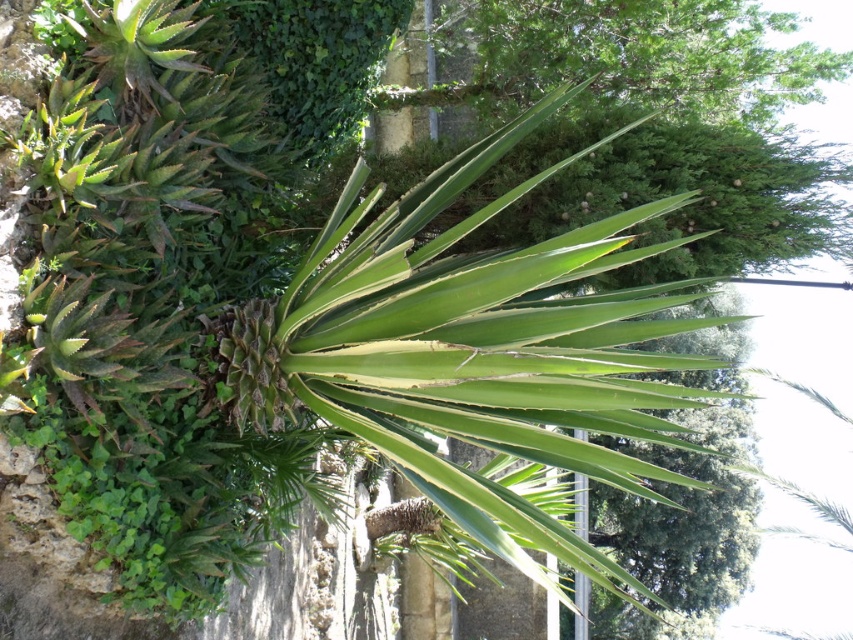
What are the coordinates of the green leafy palm tree at center?

The green leafy palm tree at center is located at coordinates point (474, 352).

You are a gardener who needs to water both the green leafy palm tree at center and the green leafy plant at center. Your watering can has a range of 3 meters. Can you water both plants without moving the watering can?

The distance between the green leafy palm tree at center and the green leafy plant at center is 3.38 meters, which exceeds the watering can range of 3 meters. Therefore, you cannot water both plants without moving the watering can.

Consider the image. You are standing in the garden and want to determine the relative positions of two points marked in the scene. Which point is closer to you, point [358,179] or point [486,49]?

A: Point [358,179] is closer to the viewer than point [486,49].